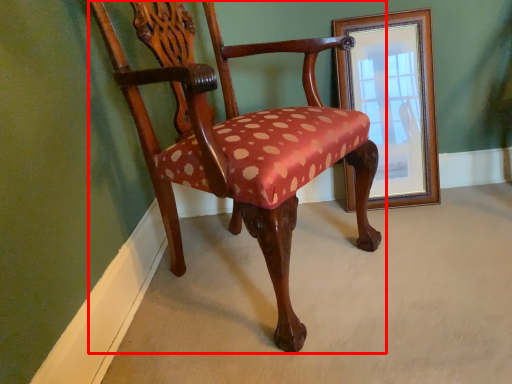
Question: From the image, what is the correct spatial relationship of chair (annotated by the red box) in relation to picture frame?

Choices:
 (A) right
 (B) left

Answer: (B)